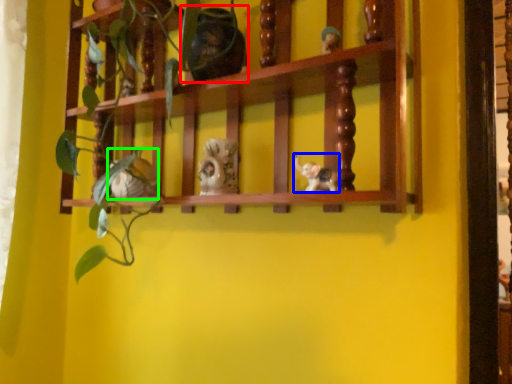
Question: Which object is the farthest from toy (highlighted by a red box)? Choose among these: toy (highlighted by a blue box) or toy (highlighted by a green box).

Choices:
 (A) toy
 (B) toy

Answer: (B)